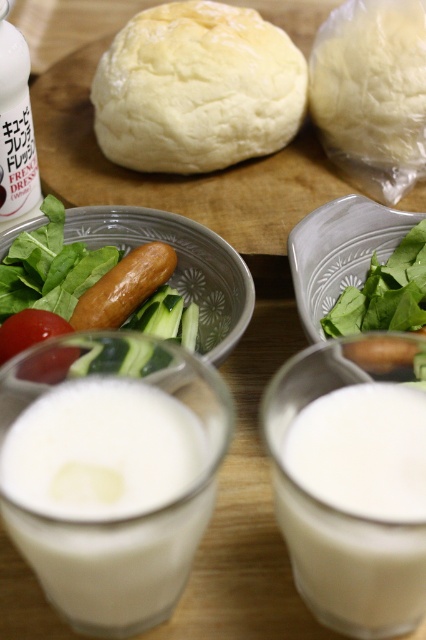
You are a chef preparing a meal and need to know which item is taller between the white frothy liquid at center and the white matte dough at upper right. Can you determine this based on their positions?

The white frothy liquid at center is not as tall as the white matte dough at upper right, so the white matte dough at upper right is taller.

You are a chef preparing a salad and need to choose between the green leafy vegetable at center and the red matte tomato at lower left. Which one should you pick if you want the larger ingredient?

The green leafy vegetable at center is larger than the red matte tomato at lower left, so you should pick the green leafy vegetable at center.

You are a chef arranging ingredients on a table. You need to place a new ingredient exactly at the center of the table. Where should you place it relative to the white matte bowl at center?

The white matte bowl at center is already positioned at the exact center of the table, so placing the new ingredient at the same location as the white matte bowl at center would place it at the center of the table.